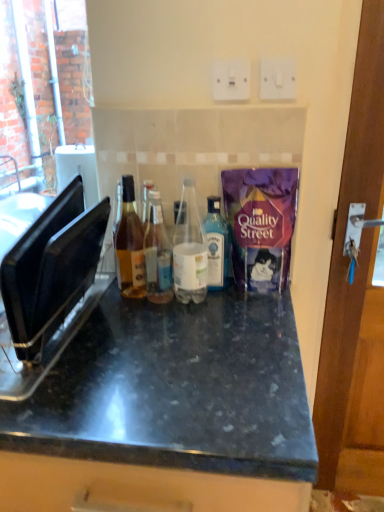
You are a GUI agent. You are given a task and a screenshot of the screen. Output one action in this format:
    pyautogui.click(x=<x>, y=<y>)
    Task: Click on the free spot to the right of black plastic toaster at left
    
    Given the screenshot: What is the action you would take?
    pyautogui.click(x=161, y=335)